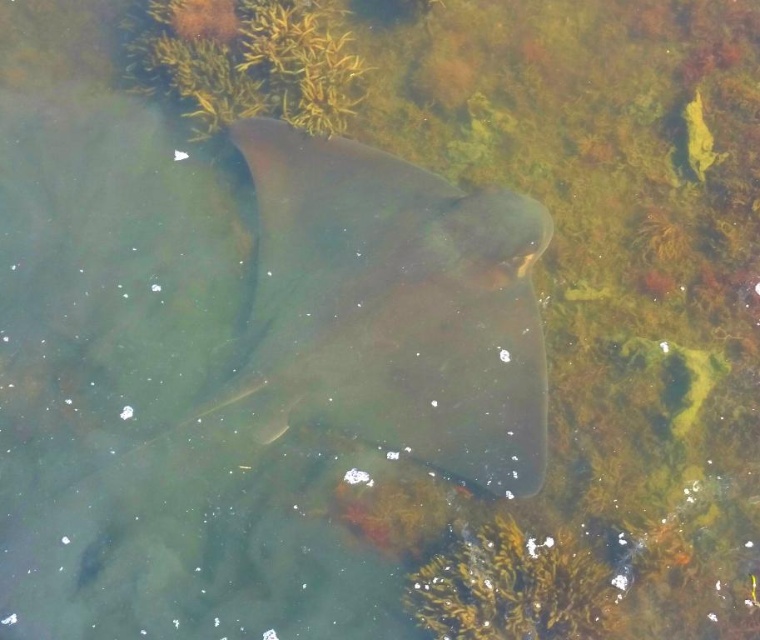
Identify the location of smooth gray stingray at center. (394, 307).

Does smooth gray stingray at center have a smaller size compared to green matte algae at lower center?

Actually, smooth gray stingray at center might be larger than green matte algae at lower center.

Find the location of a particular element. The width and height of the screenshot is (760, 640). smooth gray stingray at center is located at coordinates pos(394,307).

Is smooth gray stingray at center smaller than yellow-green fibrous algae at upper center?

Incorrect, smooth gray stingray at center is not smaller in size than yellow-green fibrous algae at upper center.

Can you confirm if smooth gray stingray at center is bigger than yellow-green fibrous algae at upper center?

Yes, smooth gray stingray at center is bigger than yellow-green fibrous algae at upper center.

Where is `smooth gray stingray at center`? The width and height of the screenshot is (760, 640). smooth gray stingray at center is located at coordinates (394, 307).

Is the position of yellow-green fibrous algae at upper center more distant than that of green matte algae at lower center?

Yes, it is behind green matte algae at lower center.

Does yellow-green fibrous algae at upper center have a greater height compared to green matte algae at lower center?

Correct, yellow-green fibrous algae at upper center is much taller as green matte algae at lower center.

At what (x,y) coordinates should I click in order to perform the action: click on yellow-green fibrous algae at upper center. Please return your answer as a coordinate pair (x, y). The height and width of the screenshot is (640, 760). Looking at the image, I should click on (249, 60).